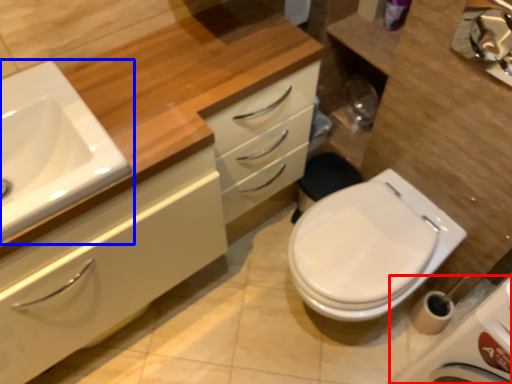
Question: Which of the following is the farthest to the observer, porcelain (highlighted by a red box) or sink (highlighted by a blue box)?

Choices:
 (A) porcelain
 (B) sink

Answer: (B)